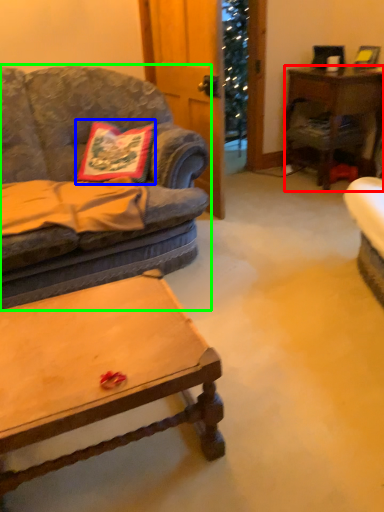
Question: Based on their relative distances, which object is nearer to desk (highlighted by a red box)? Choose from pillow (highlighted by a blue box) and studio couch (highlighted by a green box).

Choices:
 (A) pillow
 (B) studio couch

Answer: (B)